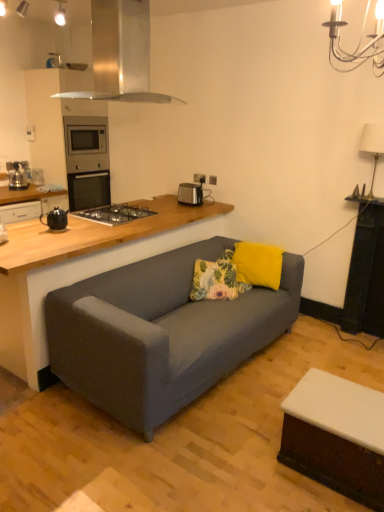
Question: Considering the relative sizes of floral fabric pillow at center, the 2th pillow from the right, and matte black toaster at upper center in the image provided, is floral fabric pillow at center, the 2th pillow from the right, thinner than matte black toaster at upper center?

Choices:
 (A) no
 (B) yes

Answer: (A)

Question: From a real-world perspective, is floral fabric pillow at center, the 2th pillow from the right, physically above matte black toaster at upper center?

Choices:
 (A) yes
 (B) no

Answer: (B)

Question: Is floral fabric pillow at center, the 2th pillow from the right, bigger than matte black toaster at upper center?

Choices:
 (A) yes
 (B) no

Answer: (A)

Question: Is floral fabric pillow at center, the 2th pillow from the right, at the left side of matte black toaster at upper center?

Choices:
 (A) no
 (B) yes

Answer: (A)

Question: Is there a large distance between floral fabric pillow at center, the 2th pillow from the right, and matte black toaster at upper center?

Choices:
 (A) yes
 (B) no

Answer: (A)

Question: Considering the relative positions of wooden countertop at lower left and black matte gas stove at center in the image provided, is wooden countertop at lower left to the left or to the right of black matte gas stove at center?

Choices:
 (A) right
 (B) left

Answer: (B)

Question: Considering the positions of wooden countertop at lower left and black matte gas stove at center in the image, is wooden countertop at lower left taller or shorter than black matte gas stove at center?

Choices:
 (A) short
 (B) tall

Answer: (B)

Question: From the image's perspective, is wooden countertop at lower left positioned above or below black matte gas stove at center?

Choices:
 (A) below
 (B) above

Answer: (A)

Question: Is point (72, 258) closer or farther from the camera than point (135, 215)?

Choices:
 (A) farther
 (B) closer

Answer: (B)

Question: Considering their positions, is black plastic toaster at upper center, the first appliance viewed from the right, located in front of or behind floral fabric pillow at center, the 2th pillow from the right?

Choices:
 (A) front
 (B) behind

Answer: (B)

Question: From a real-world perspective, is black plastic toaster at upper center, arranged as the first appliance when viewed from the back, physically located above or below floral fabric pillow at center, the first pillow from the left?

Choices:
 (A) above
 (B) below

Answer: (A)

Question: In terms of height, does black plastic toaster at upper center, which ranks as the 2th appliance in left-to-right order, look taller or shorter compared to floral fabric pillow at center, the first pillow from the left?

Choices:
 (A) short
 (B) tall

Answer: (A)

Question: Is point (200, 188) positioned closer to the camera than point (210, 290)?

Choices:
 (A) farther
 (B) closer

Answer: (A)

Question: Considering the positions of black ceramic teapot at left, which is the first appliance in front-to-back order, and stainless steel range hood at upper center in the image, is black ceramic teapot at left, which is the first appliance in front-to-back order, wider or thinner than stainless steel range hood at upper center?

Choices:
 (A) wide
 (B) thin

Answer: (B)

Question: Is black ceramic teapot at left, which is the first appliance in left-to-right order, taller or shorter than stainless steel range hood at upper center?

Choices:
 (A) tall
 (B) short

Answer: (B)